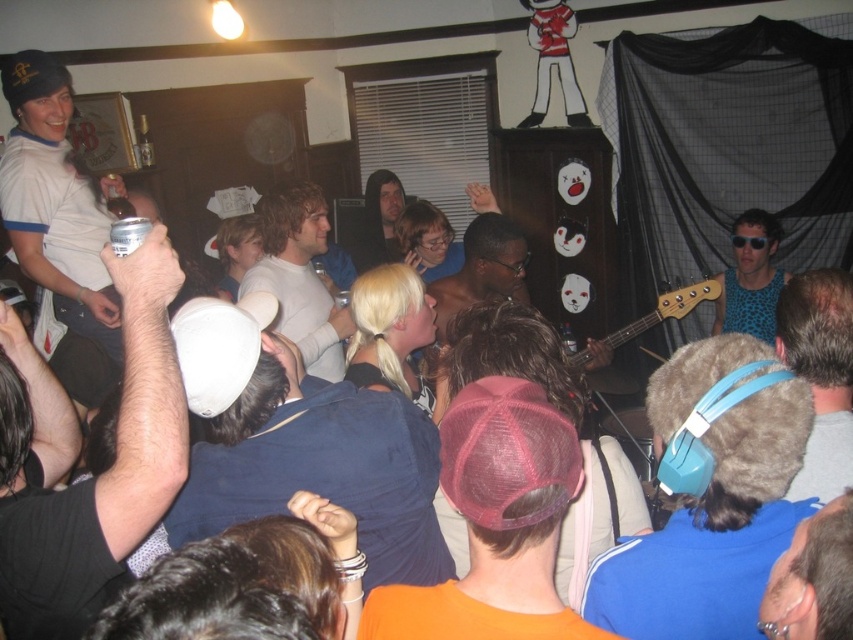
You are at the event and want to know which object is wider between the brown furry hat at center and the smooth brown leather jacket at lower right. Can you tell me?

The brown furry hat at center is wider than the smooth brown leather jacket at lower right.

You are at the live music event and want to find the musician on stage. You see the orange mesh cap at center and the matte white cap at upper left. Which cap is positioned lower on the stage?

The orange mesh cap at center is positioned lower on the stage than the matte white cap at upper left.

You are standing at the front of the stage and want to move towards the point labeled as point [692,593]. However, there is an obstacle located at point [822,630]. Will you encounter this obstacle on your path?

Since point [692,593] is further to the camera than point [822,630], moving towards point [692,593] would mean moving away from the obstacle at point [822,630]. Therefore, you will not encounter the obstacle on your path.